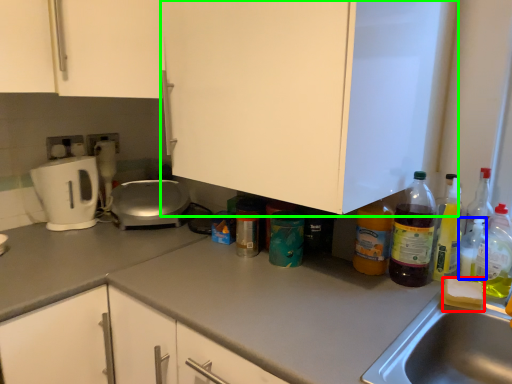
Question: Considering the real-world distances, which object is farthest from food (highlighted by a red box)? bottle (highlighted by a blue box) or cabinetry (highlighted by a green box)?

Choices:
 (A) bottle
 (B) cabinetry

Answer: (B)